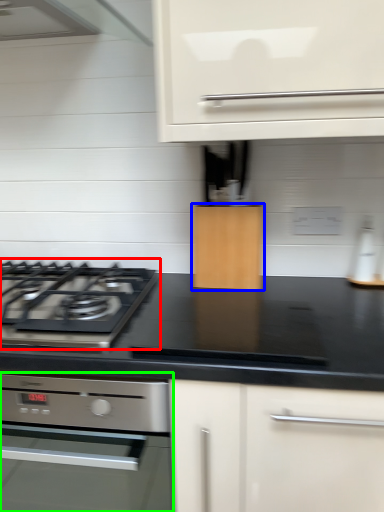
Question: Estimate the real-world distances between objects in this image. Which object is farther from gas stove (highlighted by a red box), cabinetry (highlighted by a blue box) or home appliance (highlighted by a green box)?

Choices:
 (A) cabinetry
 (B) home appliance

Answer: (B)